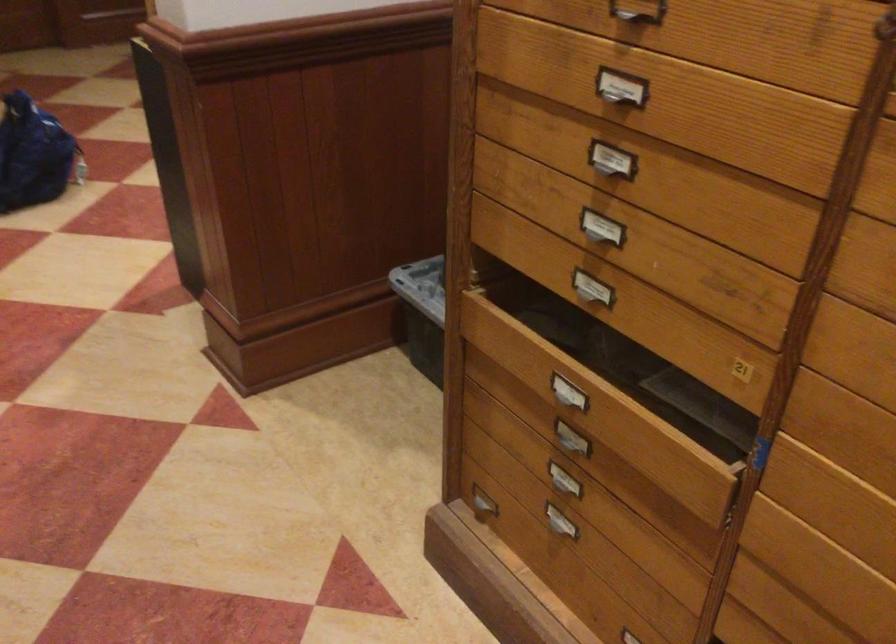
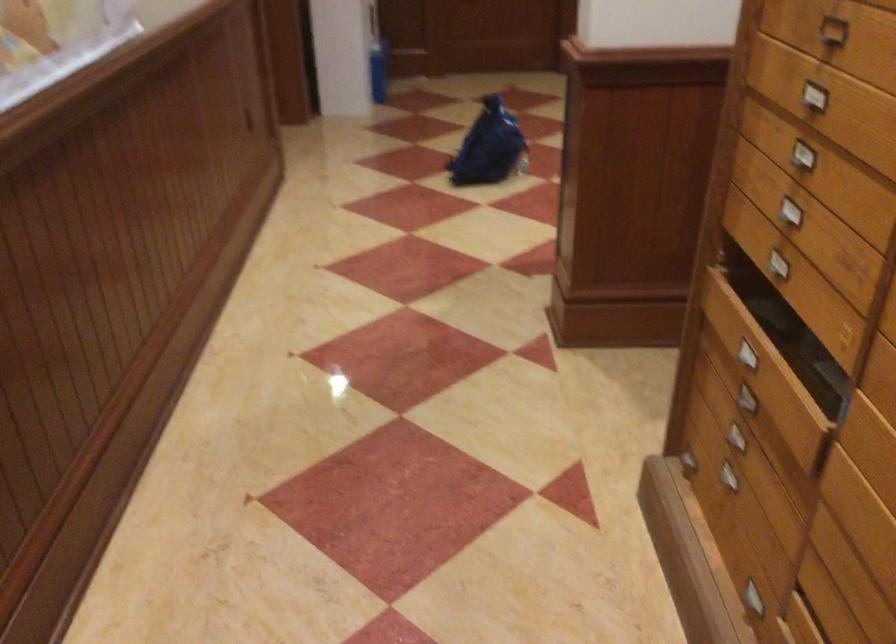
Find the pixel in the second image that matches pixel 591 220 in the first image.

(791, 205)